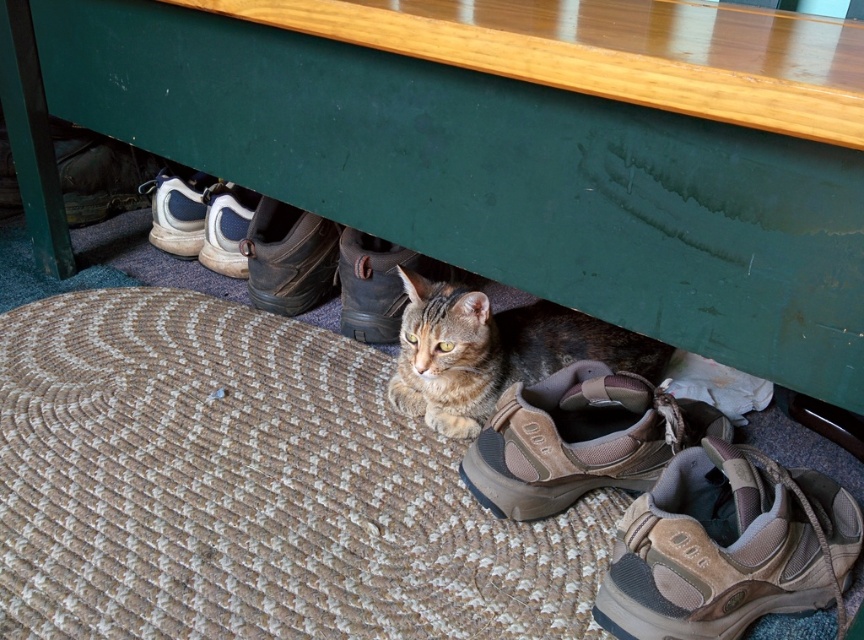
Does tabby fur cat under table appear on the right side of white leather shoe at left?

Indeed, tabby fur cat under table is positioned on the right side of white leather shoe at left.

Does tabby fur cat under table come in front of white leather shoe at left?

Yes, tabby fur cat under table is closer to the viewer.

The width and height of the screenshot is (864, 640). I want to click on tabby fur cat under table, so click(494, 352).

Is brown woven mat at center taller than tabby fur cat under table?

Yes, brown woven mat at center is taller than tabby fur cat under table.

Is brown woven mat at center closer to camera compared to tabby fur cat under table?

Yes, brown woven mat at center is closer to the viewer.

The width and height of the screenshot is (864, 640). What do you see at coordinates (251, 490) in the screenshot?
I see `brown woven mat at center` at bounding box center [251, 490].

Locate an element on the screen. The height and width of the screenshot is (640, 864). brown woven mat at center is located at coordinates (251, 490).

Does green painted wood table at center lie behind brown suede shoe at lower right?

No, it is in front of brown suede shoe at lower right.

Does point (831, 284) come behind point (693, 481)?

No, (831, 284) is closer to viewer.

Where is `green painted wood table at center`? green painted wood table at center is located at coordinates (473, 173).